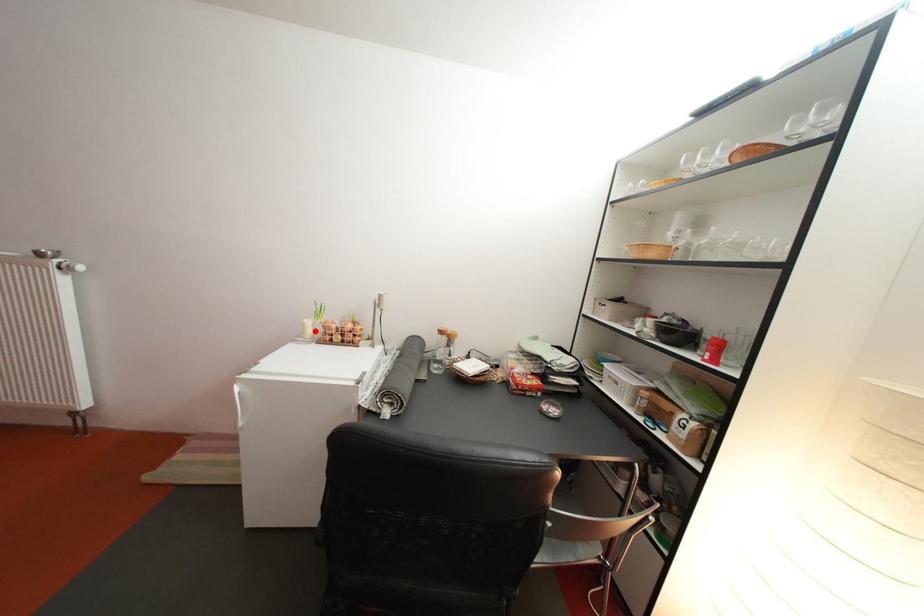
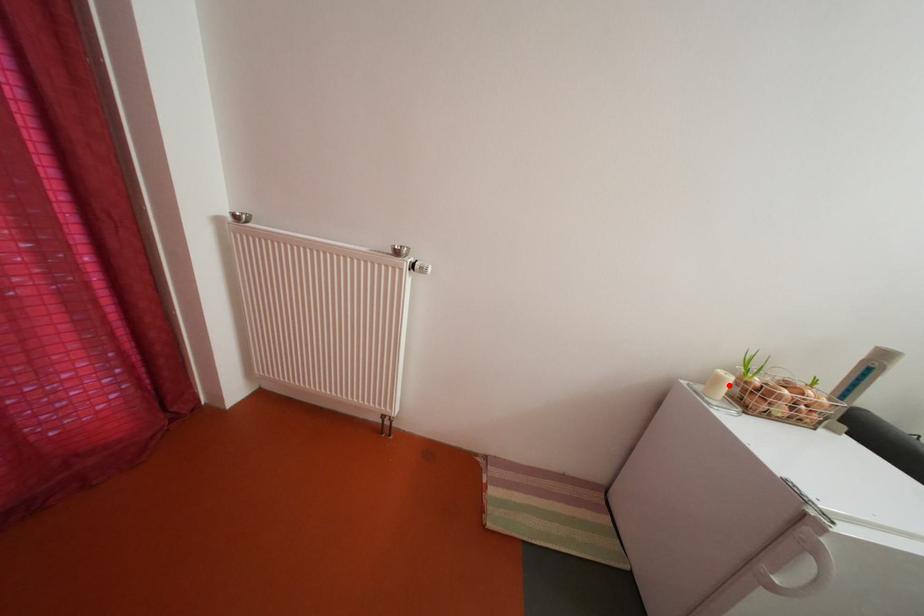
I am providing you with two images of the same scene from different viewpoints. A red point is marked on the first image and another point is marked on the second image. Do the highlighted points in image1 and image2 indicate the same real-world spot?

Yes